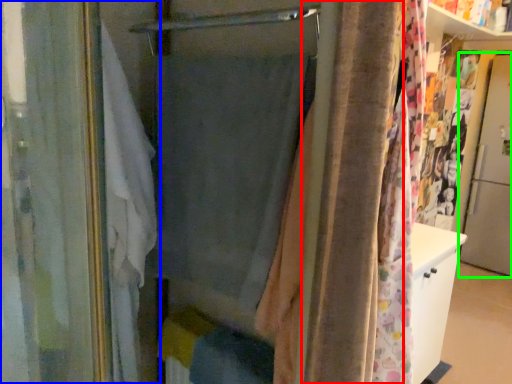
Question: Which object is positioned farthest from shower curtain (highlighted by a red box)? Select from curtain (highlighted by a blue box) and screen door (highlighted by a green box).

Choices:
 (A) curtain
 (B) screen door

Answer: (B)